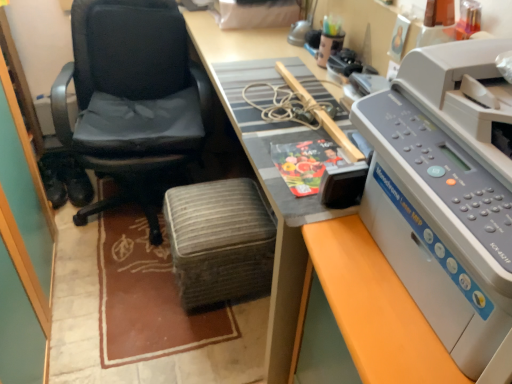
Question: Would you say wooden desk at center is to the left or to the right of woven fabric stool at center in the picture?

Choices:
 (A) left
 (B) right

Answer: (B)

Question: From the image's perspective, is wooden desk at center positioned above or below woven fabric stool at center?

Choices:
 (A) below
 (B) above

Answer: (B)

Question: Considering the real-world distances, which object is closest to the black leather chair at left?

Choices:
 (A) gray plastic printer at right
 (B) brown woven mat at lower left
 (C) wooden desk at center
 (D) woven fabric stool at center
 (E) black leather shoes at left

Answer: (C)

Question: Based on their relative distances, which object is nearer to the gray plastic printer at right?

Choices:
 (A) wooden desk at center
 (B) brown woven mat at lower left
 (C) woven fabric stool at center
 (D) black leather shoes at left
 (E) black leather chair at left

Answer: (A)